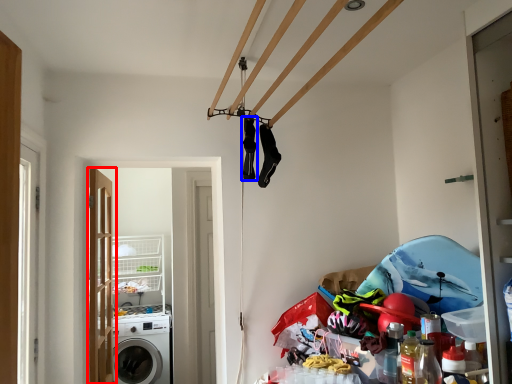
Question: Which of the following is the closest to the observer, door (highlighted by a red box) or clothing (highlighted by a blue box)?

Choices:
 (A) door
 (B) clothing

Answer: (B)